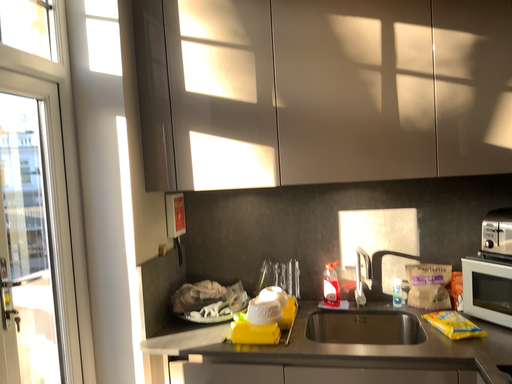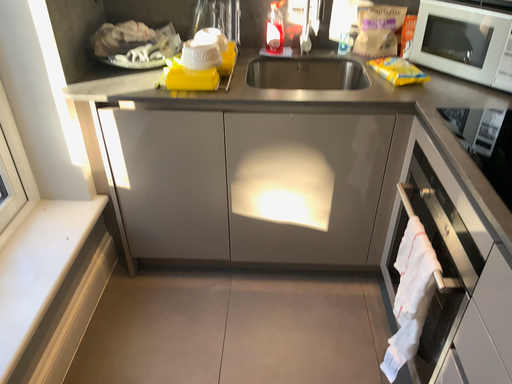
Question: Which way did the camera rotate in the video?

Choices:
 (A) rotated upward
 (B) rotated downward

Answer: (B)